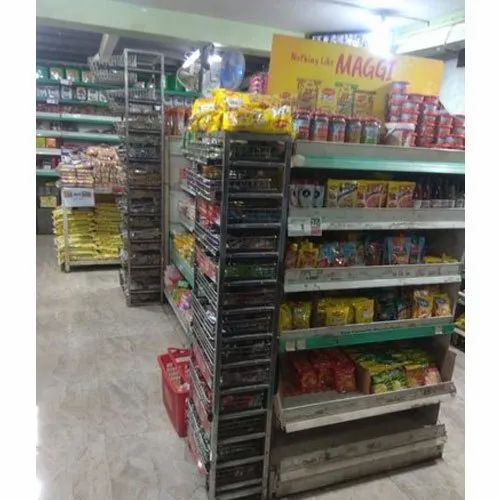
Where is `mirror`? This screenshot has width=500, height=500. mirror is located at coordinates (233, 64).